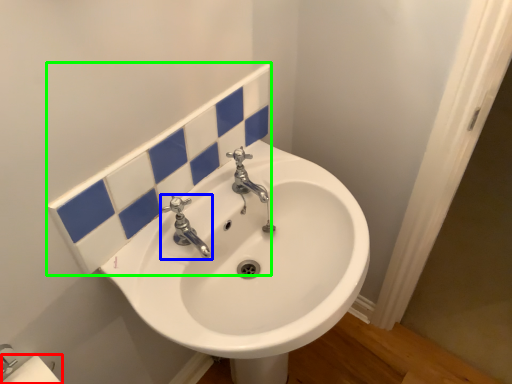
Question: Which is farther away from toilet paper (highlighted by a red box)? tap (highlighted by a blue box) or tile (highlighted by a green box)?

Choices:
 (A) tap
 (B) tile

Answer: (B)